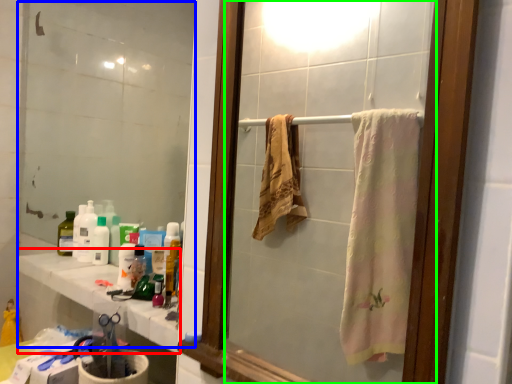
Question: Considering the real-world distances, which object is closest to counter top (highlighted by a red box)? mirror (highlighted by a blue box) or mirror (highlighted by a green box).

Choices:
 (A) mirror
 (B) mirror

Answer: (A)